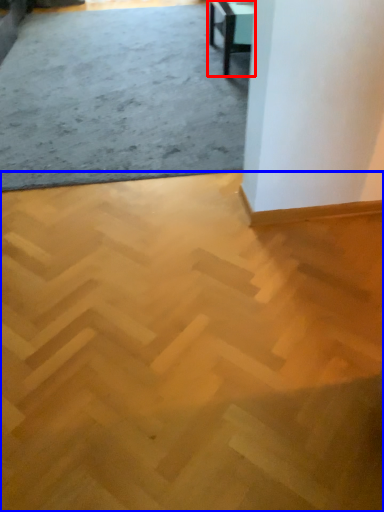
Question: Which point is further to the camera, table (highlighted by a red box) or concrete (highlighted by a blue box)?

Choices:
 (A) table
 (B) concrete

Answer: (A)